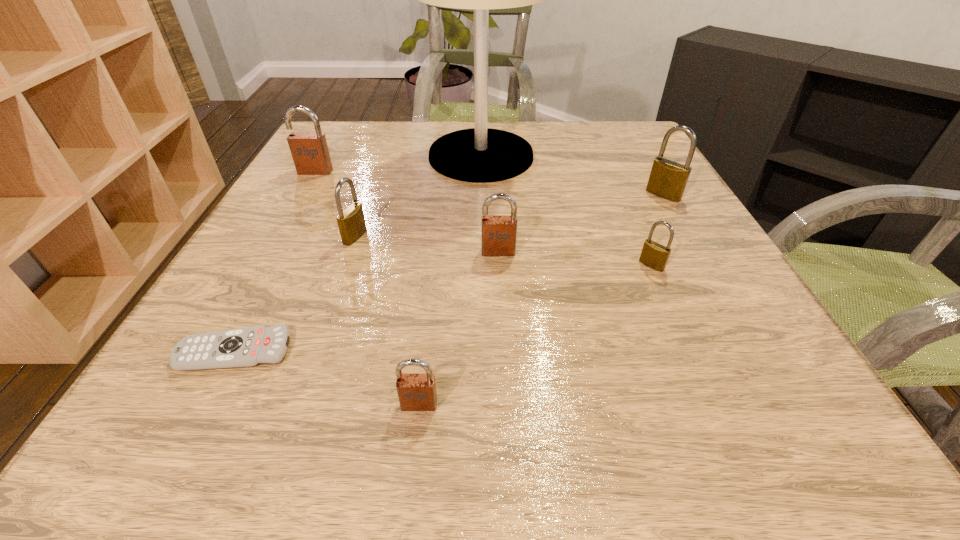
Find the location of a particular element. The width and height of the screenshot is (960, 540). free space located 0.100m on the front-facing side of the fourth farthest padlock is located at coordinates (500, 296).

Find the location of `vacant area situated 0.280m on the front of the third nearest object`. vacant area situated 0.280m on the front of the third nearest object is located at coordinates (722, 424).

At what (x,y) coordinates should I click in order to perform the action: click on vacant position located 0.200m on the back of the shortest object. Please return your answer as a coordinate pair (x, y). This screenshot has width=960, height=540. Looking at the image, I should click on (289, 246).

This screenshot has width=960, height=540. Identify the location of object that is at the far edge. (479, 155).

Locate an element on the screen. This screenshot has width=960, height=540. object that is at the near edge is located at coordinates (416, 392).

Where is `padlock located at the left edge`? The image size is (960, 540). padlock located at the left edge is located at coordinates (309, 150).

I want to click on remote control situated at the left edge, so click(251, 346).

Where is `vacant space at the far edge of the desktop`? The width and height of the screenshot is (960, 540). vacant space at the far edge of the desktop is located at coordinates (384, 162).

In the image, there is a desktop. Where is `free space at the near edge`? free space at the near edge is located at coordinates [423, 431].

Locate an element on the screen. Image resolution: width=960 pixels, height=540 pixels. vacant space at the left edge of the desktop is located at coordinates (249, 252).